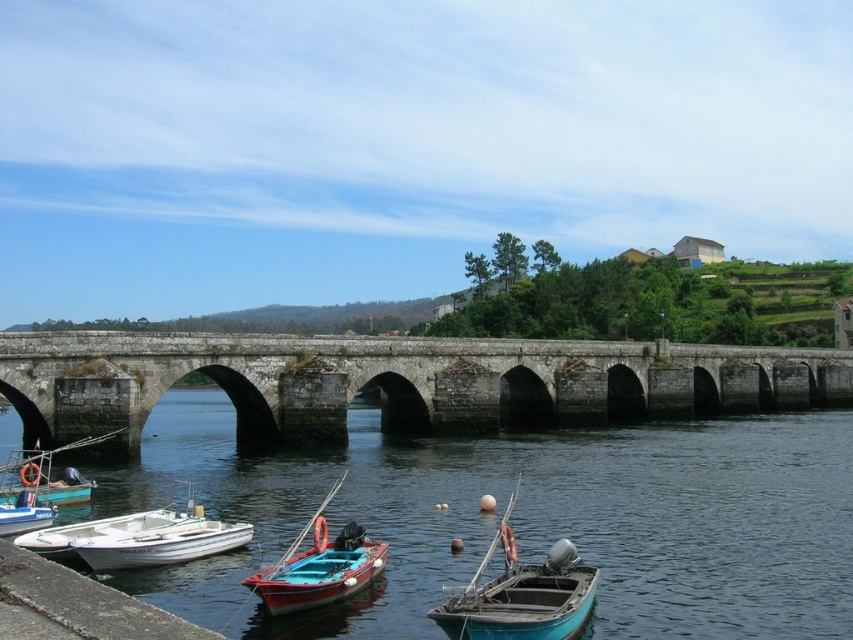
Looking at this image, you are standing on the riverside and want to board the wooden boat at center and the teal matte boat at lower left. Which boat will you reach first without moving your position?

The wooden boat at center is closer to the viewer than the teal matte boat at lower left, so you will reach the wooden boat at center first without moving your position.